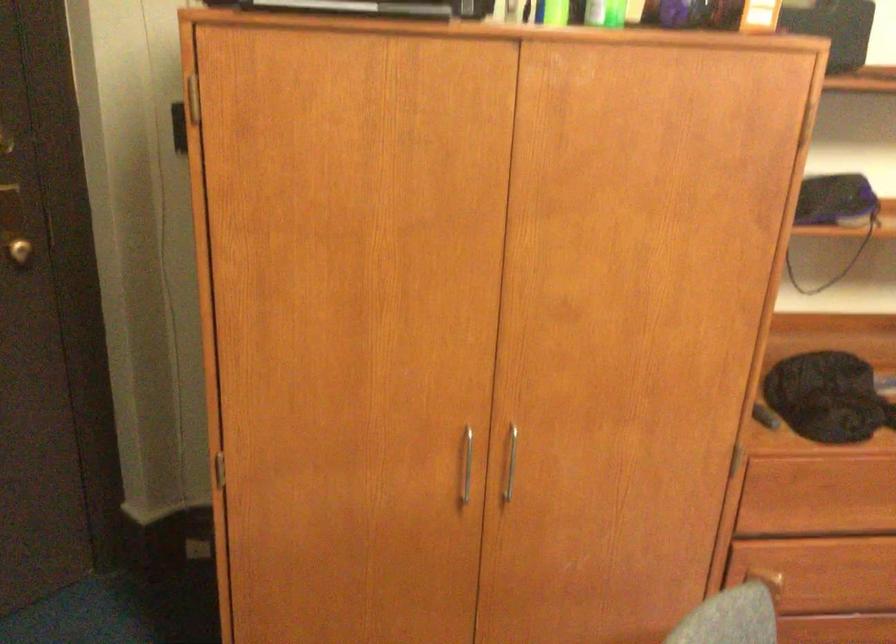
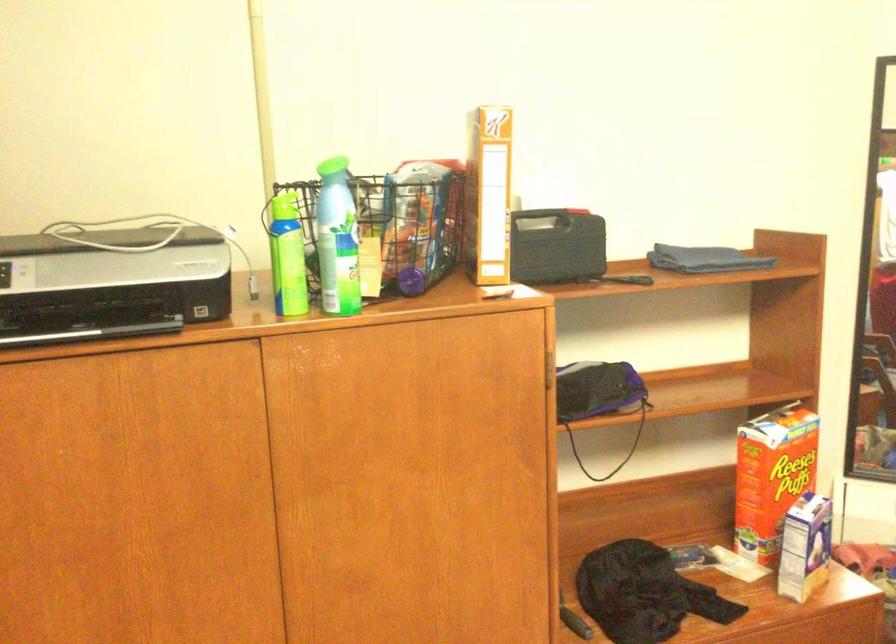
Question: The camera is either moving clockwise (left) or counter-clockwise (right) around the object. The first image is from the beginning of the video and the second image is from the end. Is the camera moving left or right when shooting the video?

Choices:
 (A) Left
 (B) Right

Answer: (A)